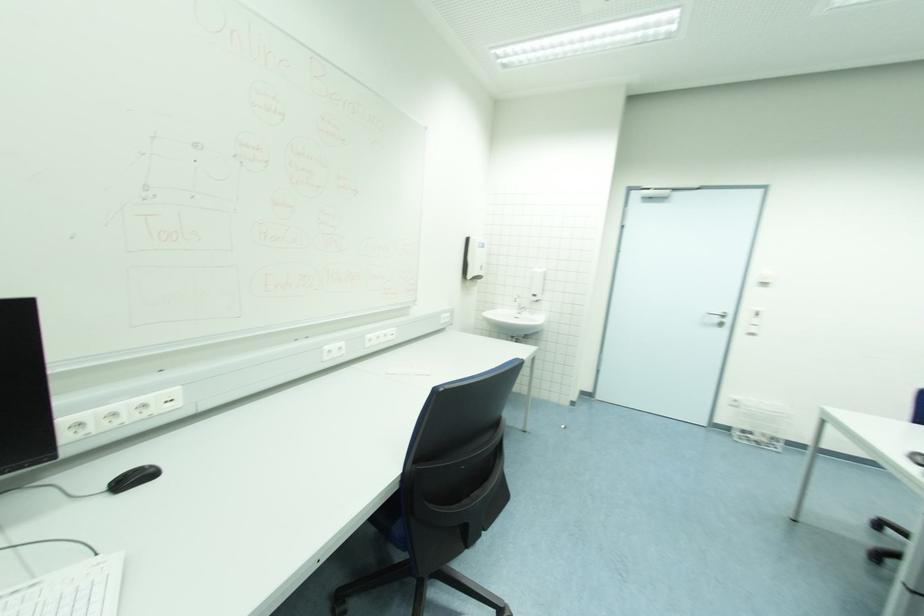
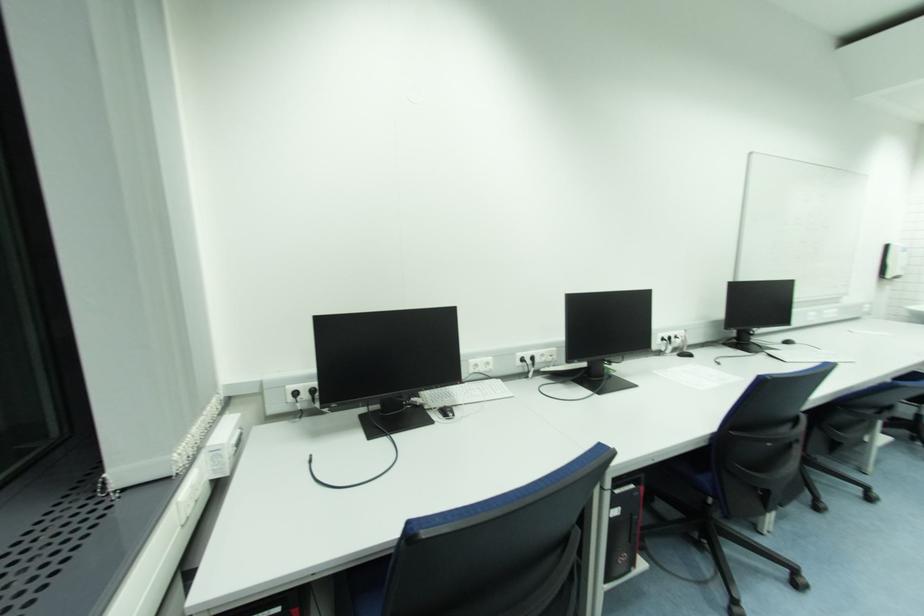
Locate, in the second image, the point that corresponds to pixel 469 241 in the first image.

(892, 248)